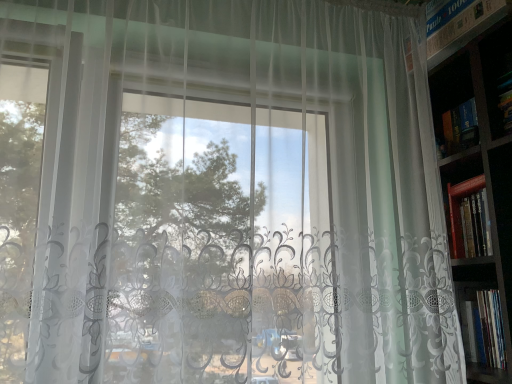
Identify the location of hardcover book at right. (482, 326).

What do you see at coordinates (482, 326) in the screenshot? I see `hardcover book at right` at bounding box center [482, 326].

The height and width of the screenshot is (384, 512). Find the location of `hardcover book at right`. hardcover book at right is located at coordinates (482, 326).